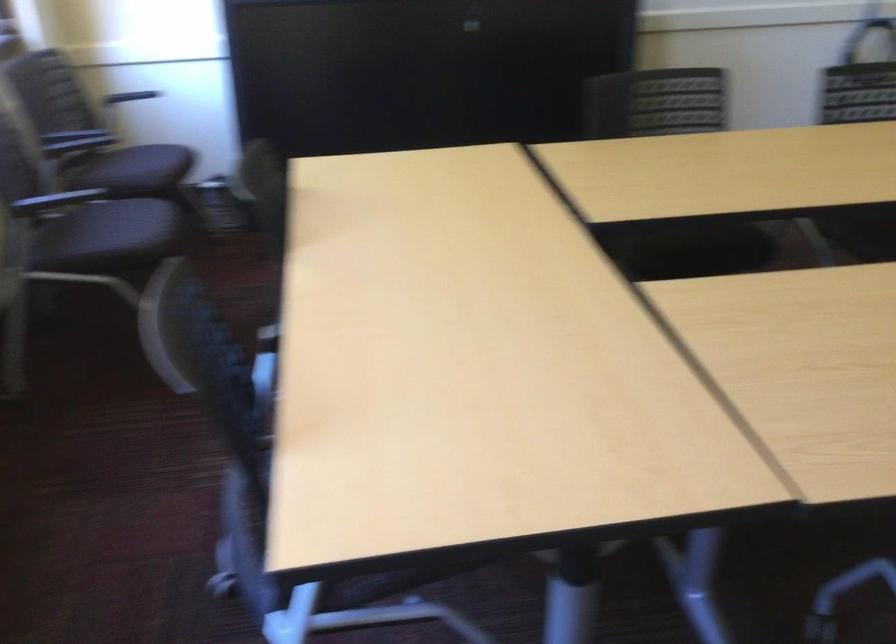
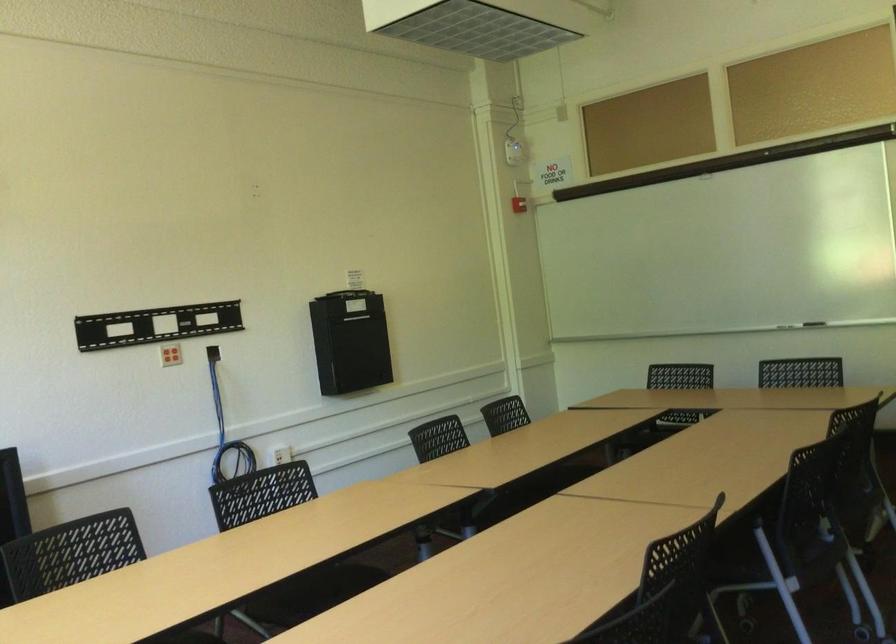
The images are taken continuously from a first-person perspective. In which direction is your viewpoint rotating?

The camera's rotation is toward right-up.